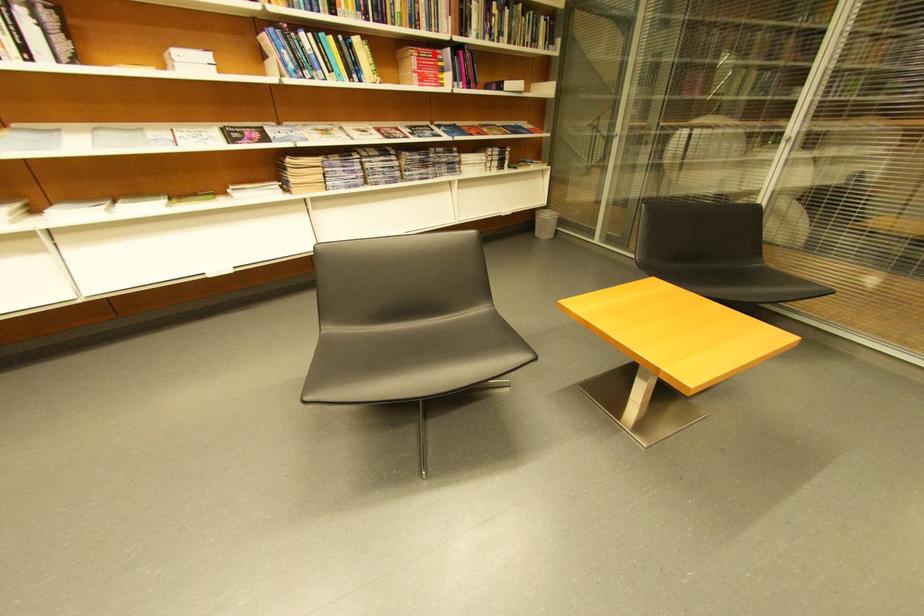
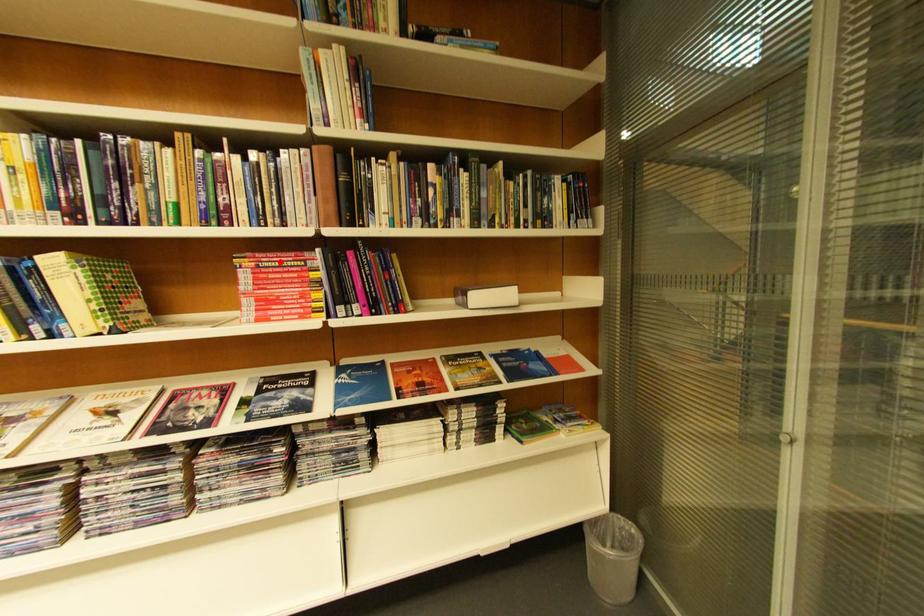
I am providing you with two images of the same scene from different viewpoints. A red point is marked on the first image and another point is marked on the second image. Do the highlighted points in image1 and image2 indicate the same real-world spot?

Yes